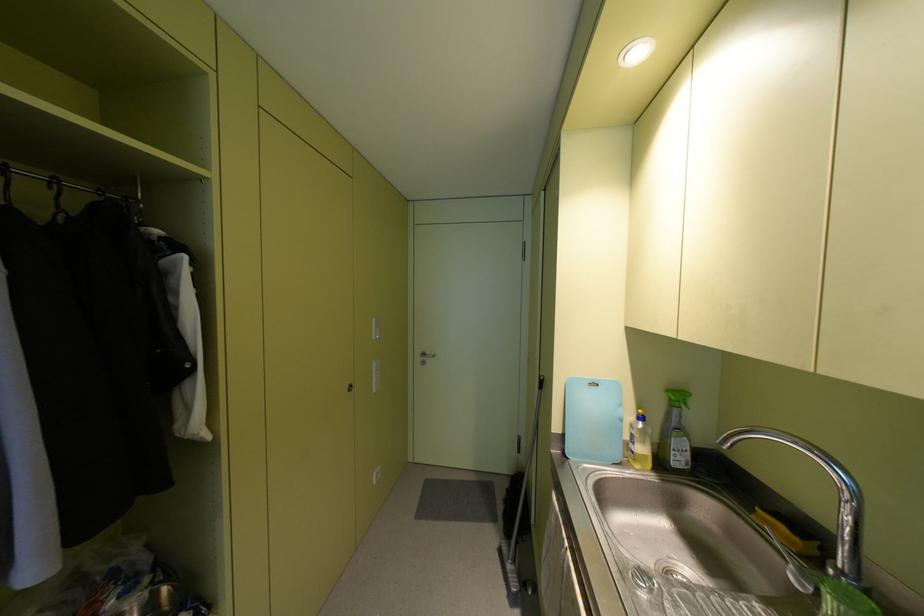
This screenshot has width=924, height=616. I want to click on faucet handle, so click(x=792, y=553).